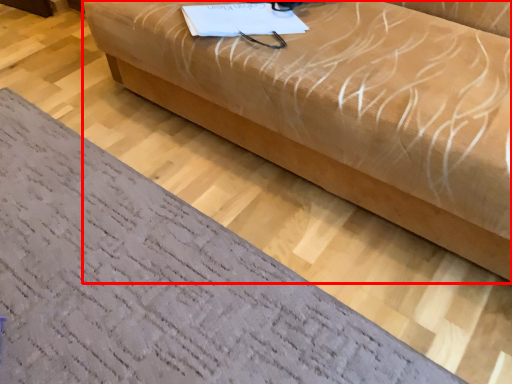
Question: In this image, where is studio couch (annotated by the red box) located relative to furniture?

Choices:
 (A) right
 (B) left

Answer: (A)